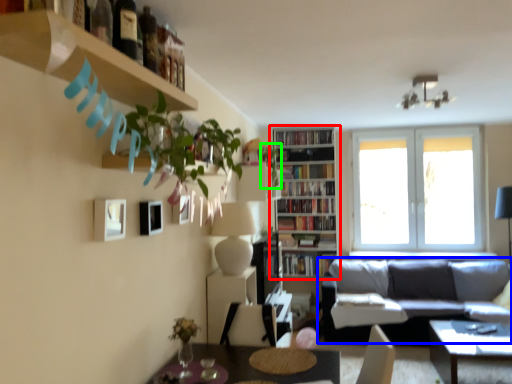
Question: Estimate the real-world distances between objects in this image. Which object is closer to bookcase (highlighted by a red box), studio couch (highlighted by a blue box) or plant (highlighted by a green box)?

Choices:
 (A) studio couch
 (B) plant

Answer: (B)